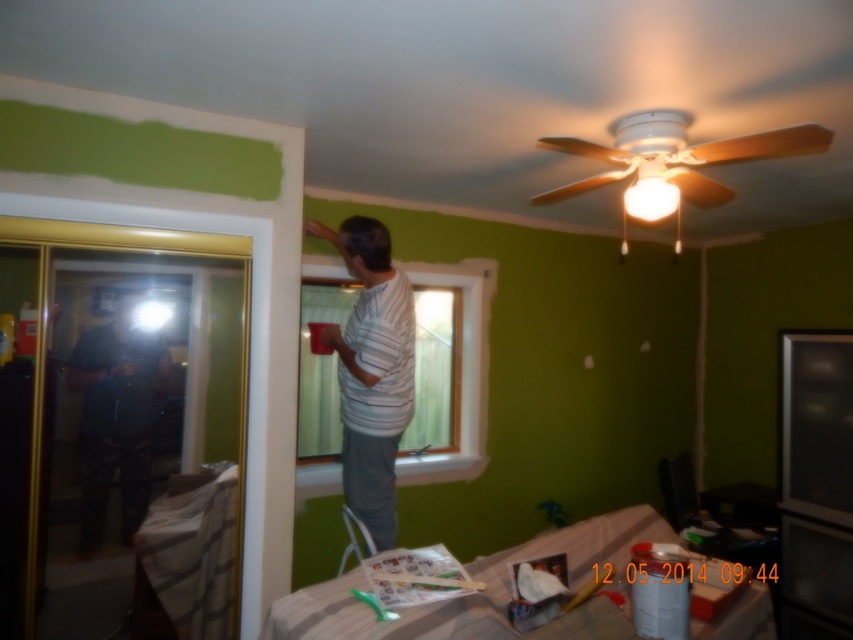
Question: Which point appears farthest from the camera in this image?

Choices:
 (A) (469, 470)
 (B) (397, 300)

Answer: (A)

Question: Does dark blue shirt at left come in front of clear glass window at center?

Choices:
 (A) no
 (B) yes

Answer: (B)

Question: Is white striped shirt at center above dark blue shirt at left?

Choices:
 (A) no
 (B) yes

Answer: (B)

Question: Which point appears closest to the camera in this image?

Choices:
 (A) (428, 460)
 (B) (82, 518)
 (C) (364, 508)

Answer: (B)

Question: Among these objects, which one is nearest to the camera?

Choices:
 (A) dark blue shirt at left
 (B) white striped shirt at center

Answer: (A)

Question: Can you confirm if white striped shirt at center is positioned below clear glass window at center?

Choices:
 (A) yes
 (B) no

Answer: (B)